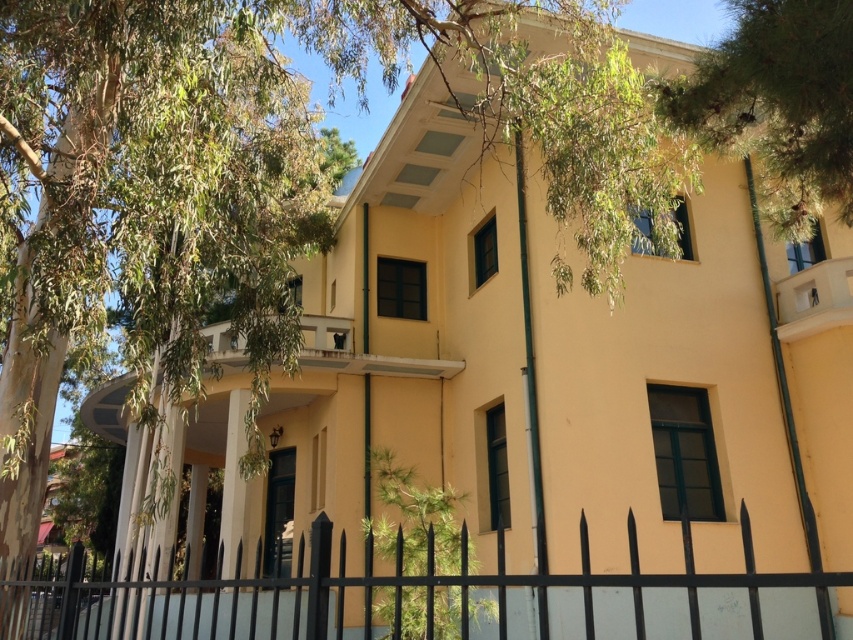
You are standing in front of the two story building and looking at the green leafy tree at upper left and the green leafy tree at upper right. Which tree is closer to the building?

The green leafy tree at upper left is closer to the building because it is positioned under the green leafy tree at upper right, indicating it is in front of it.

You are standing in front of the building and want to take a photo that includes the green leafy tree at upper left. What part of the building should you position the tree in your camera frame to ensure it appears at the top left corner?

To position the green leafy tree at upper left in the top left corner of your camera frame, align it with the upper left area of the viewfinder since its 2D coordinates are at point (196, 179), which places it near the top left of the image.

You are a gardener standing in front of the building and want to trim the green leafy tree at upper left so it doesn not block the view of the black metal fence at lower center. Can you do this without cutting the tree below its current height?

The green leafy tree at upper left is not as tall as the black metal fence at lower center, so trimming the tree to reduce its height would not be necessary to unblock the view of the fence since the tree is already shorter than the fence.